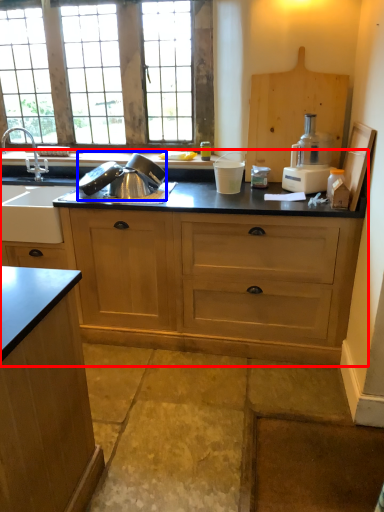
Question: Which of the following is the farthest to the observer, countertop (highlighted by a red box) or appliance (highlighted by a blue box)?

Choices:
 (A) countertop
 (B) appliance

Answer: (B)